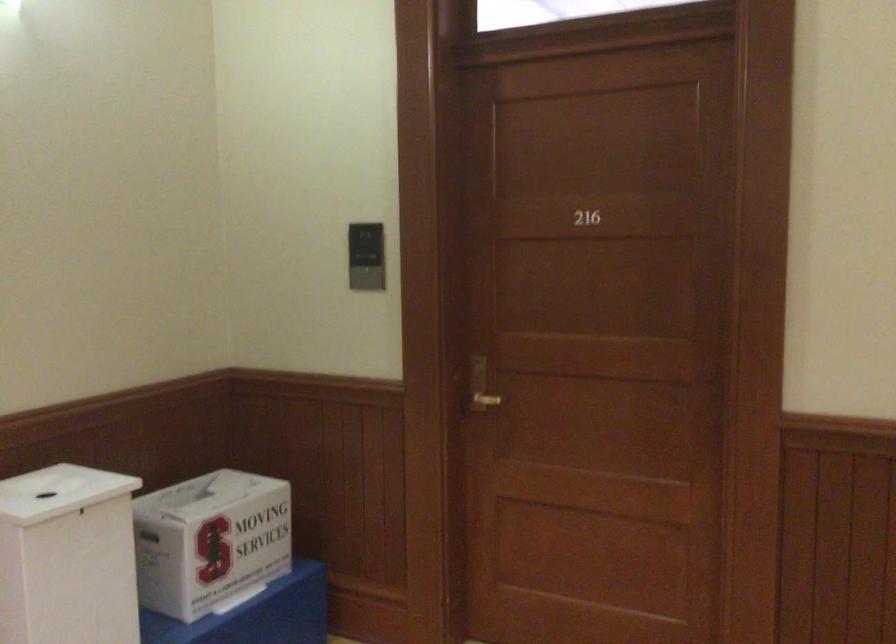
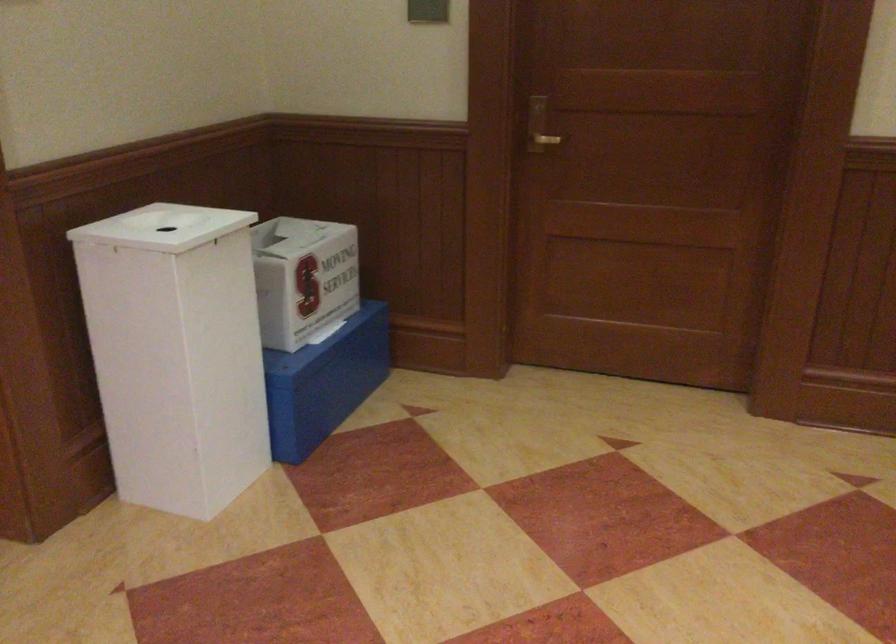
Locate, in the second image, the point that corresponds to the point at 480,386 in the first image.

(538, 126)